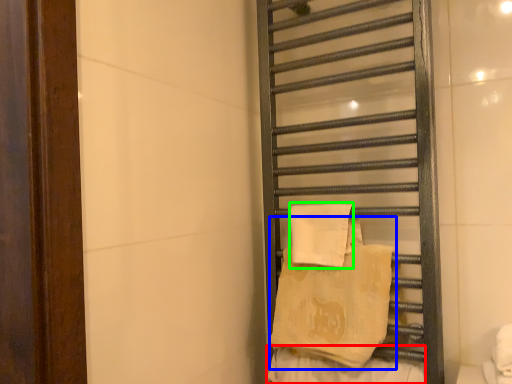
Question: Considering the real-world distances, which object is closest to material (highlighted by a red box)? beach towel (highlighted by a blue box) or beach towel (highlighted by a green box).

Choices:
 (A) beach towel
 (B) beach towel

Answer: (A)